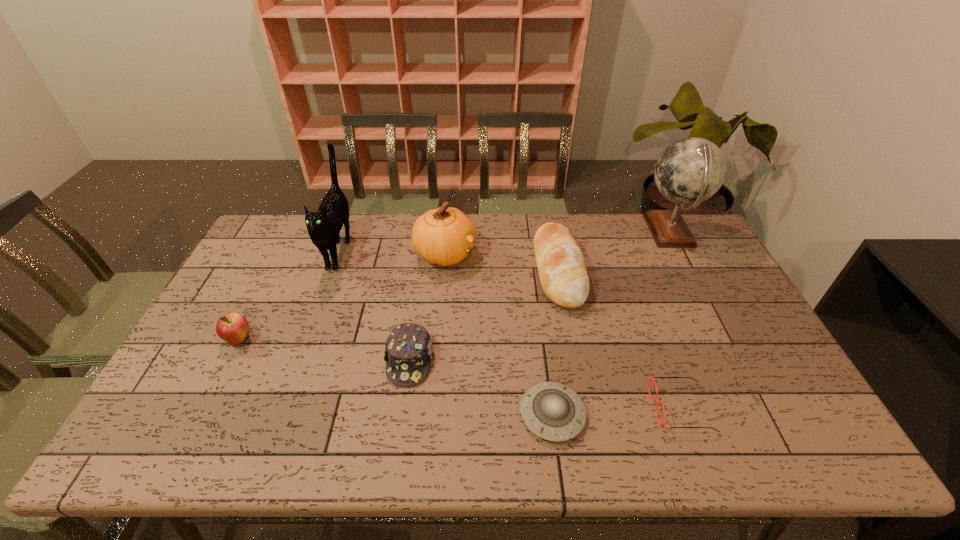
Where is `free space between the bread and the sixth shortest object`? Image resolution: width=960 pixels, height=540 pixels. free space between the bread and the sixth shortest object is located at coordinates (501, 262).

I want to click on vacant area that lies between the second shortest object and the rightmost object, so click(x=675, y=320).

At what (x,y) coordinates should I click in order to perform the action: click on object identified as the sixth closest to the apple. Please return your answer as a coordinate pair (x, y). This screenshot has width=960, height=540. Looking at the image, I should click on (650, 378).

This screenshot has height=540, width=960. In order to click on object identified as the seventh closest to the globe in this screenshot , I will do `click(232, 327)`.

Where is `vacant area in the image that satisfies the following two spatial constraints: 1. on the face of the saucer; 2. on the left side of the cat`? The image size is (960, 540). vacant area in the image that satisfies the following two spatial constraints: 1. on the face of the saucer; 2. on the left side of the cat is located at coordinates tap(279, 414).

At what (x,y) coordinates should I click in order to perform the action: click on free spot that satisfies the following two spatial constraints: 1. on the front face of the pumpkin; 2. on the front side of the leftmost object. Please return your answer as a coordinate pair (x, y). This screenshot has width=960, height=540. Looking at the image, I should click on (437, 340).

You are a GUI agent. You are given a task and a screenshot of the screen. Output one action in this format:
    pyautogui.click(x=<x>, y=<y>)
    Task: Click on the free space that satisfies the following two spatial constraints: 1. on the front face of the bread; 2. on the right side of the sixth shortest object
    The image size is (960, 540).
    Given the screenshot: What is the action you would take?
    (444, 271)

Find the location of a particular element. vacant space that satisfies the following two spatial constraints: 1. at the equator of the rightmost object; 2. on the face of the cat is located at coordinates (679, 249).

Where is `vacant area that satisfies the following two spatial constraints: 1. on the front face of the sixth shortest object; 2. on the front-facing side of the headwear`? vacant area that satisfies the following two spatial constraints: 1. on the front face of the sixth shortest object; 2. on the front-facing side of the headwear is located at coordinates (436, 360).